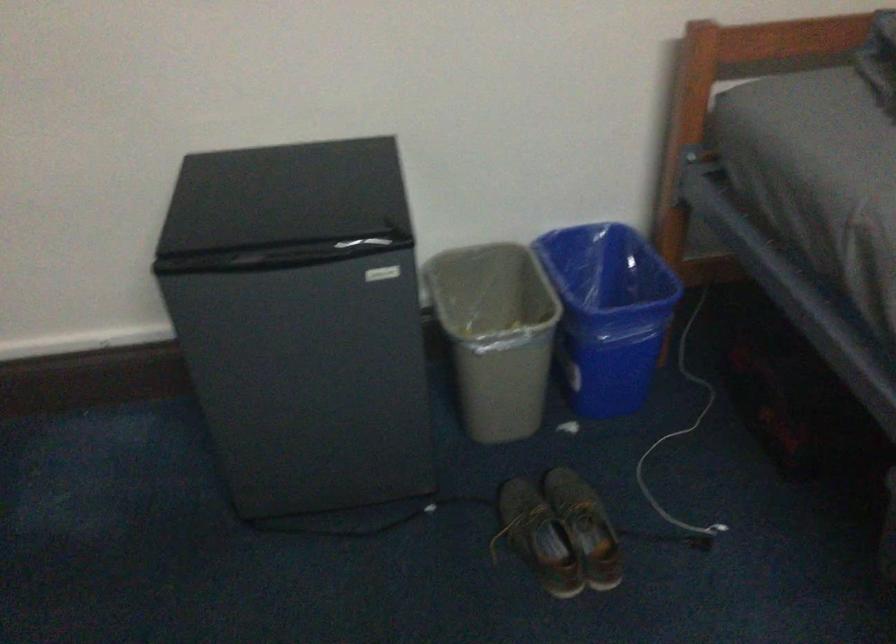
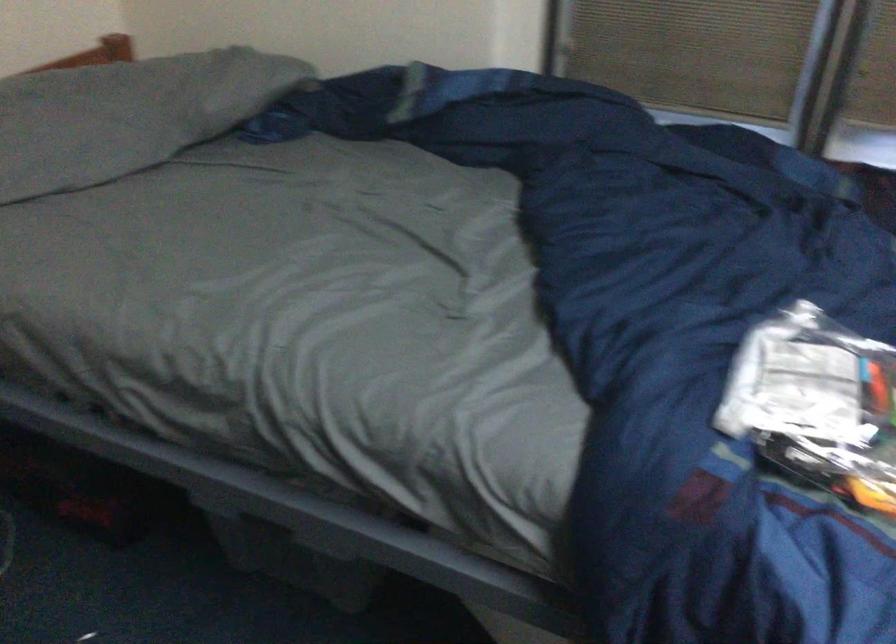
Question: The camera is either moving clockwise (left) or counter-clockwise (right) around the object. The first image is from the beginning of the video and the second image is from the end. Is the camera moving left or right when shooting the video?

Choices:
 (A) Left
 (B) Right

Answer: (A)